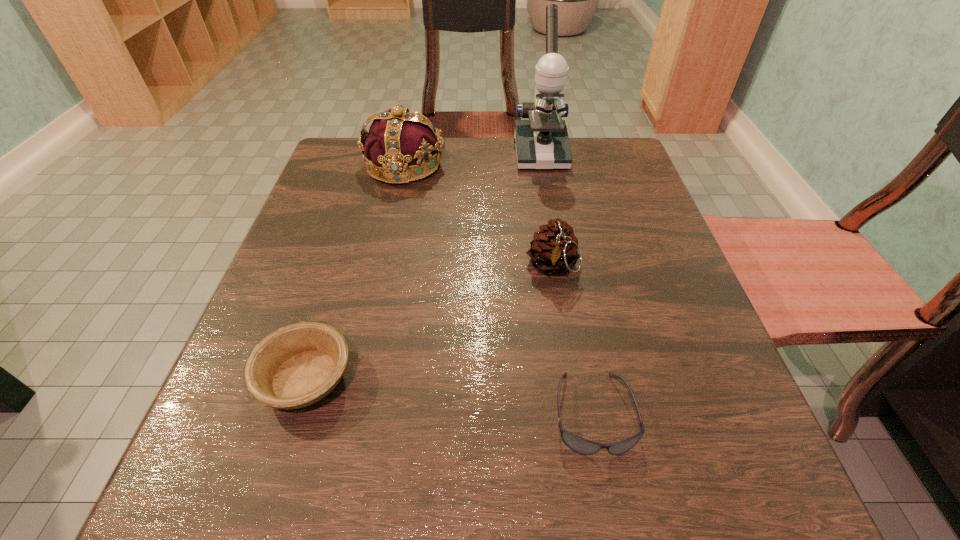
Identify the location of free space that is in between the second tallest object and the shortest object. This screenshot has height=540, width=960. (498, 289).

Where is `vacant region between the microscope and the crown`? The height and width of the screenshot is (540, 960). vacant region between the microscope and the crown is located at coordinates (472, 159).

Where is `vacant space that is in between the tallest object and the shortest object`? Image resolution: width=960 pixels, height=540 pixels. vacant space that is in between the tallest object and the shortest object is located at coordinates (566, 283).

You are a GUI agent. You are given a task and a screenshot of the screen. Output one action in this format:
    pyautogui.click(x=<x>, y=<y>)
    Task: Click on the free area in between the microscope and the sunglasses
    The image size is (960, 540).
    Given the screenshot: What is the action you would take?
    pyautogui.click(x=566, y=283)

Find the location of a particular element. The width and height of the screenshot is (960, 540). free space between the fourth shortest object and the microscope is located at coordinates (472, 159).

Locate an element on the screen. This screenshot has height=540, width=960. empty location between the pinecone and the fourth tallest object is located at coordinates (429, 322).

Identify the location of object that stands as the third closest to the pinecone. (542, 142).

You are a GUI agent. You are given a task and a screenshot of the screen. Output one action in this format:
    pyautogui.click(x=<x>, y=<y>)
    Task: Click on the second closest object to the crown
    This screenshot has height=540, width=960.
    Given the screenshot: What is the action you would take?
    pyautogui.click(x=554, y=250)